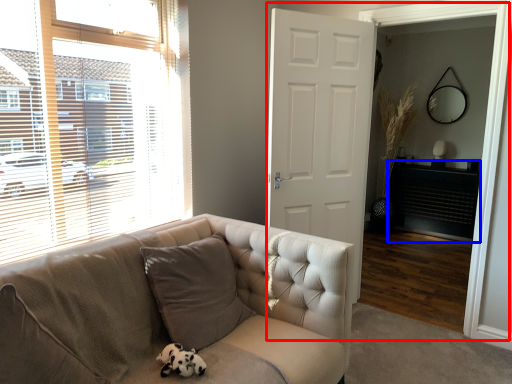
Question: Among these objects, which one is farthest to the camera, screen door (highlighted by a red box) or fireplace (highlighted by a blue box)?

Choices:
 (A) screen door
 (B) fireplace

Answer: (B)